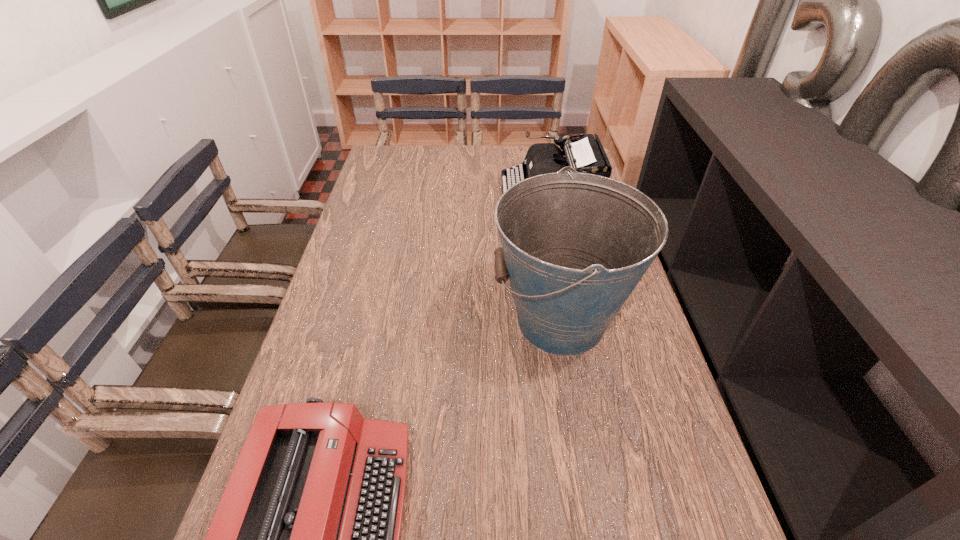
Where is `object positioned at the far edge`? The image size is (960, 540). object positioned at the far edge is located at coordinates (585, 154).

Identify the location of bucket at the right edge. This screenshot has height=540, width=960. (574, 246).

Locate an element on the screen. Image resolution: width=960 pixels, height=540 pixels. typewriter that is at the right edge is located at coordinates (585, 154).

At what (x,y) coordinates should I click in order to perform the action: click on object positioned at the far right corner. Please return your answer as a coordinate pair (x, y). The image size is (960, 540). Looking at the image, I should click on (585, 154).

Where is `free location at the far edge of the desktop`? The height and width of the screenshot is (540, 960). free location at the far edge of the desktop is located at coordinates pyautogui.click(x=443, y=144).

Locate an element on the screen. vacant space at the left edge of the desktop is located at coordinates (356, 370).

Where is `free spot at the far left corner of the desktop`? free spot at the far left corner of the desktop is located at coordinates (398, 165).

This screenshot has width=960, height=540. What are the coordinates of `object that can be found as the closest to the farther typewriter` in the screenshot? It's located at (574, 246).

You are a GUI agent. You are given a task and a screenshot of the screen. Output one action in this format:
    pyautogui.click(x=<x>, y=<y>)
    Task: Click on the second closest object to the taller typewriter
    The height and width of the screenshot is (540, 960).
    Given the screenshot: What is the action you would take?
    pyautogui.click(x=306, y=538)